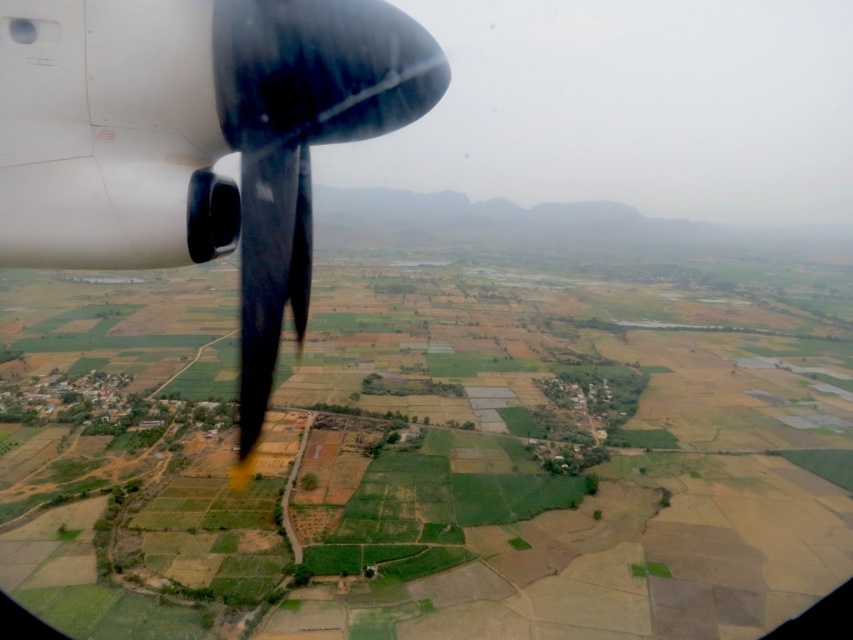
Who is positioned more to the left, green grassy farmland at center or polished metallic propeller at upper left?

polished metallic propeller at upper left

Is green grassy farmland at center in front of polished metallic propeller at upper left?

That is False.

Is point (787, 346) positioned behind point (254, 220)?

Yes, point (787, 346) is farther from viewer.

This screenshot has width=853, height=640. What are the coordinates of `green grassy farmland at center` in the screenshot? It's located at (437, 451).